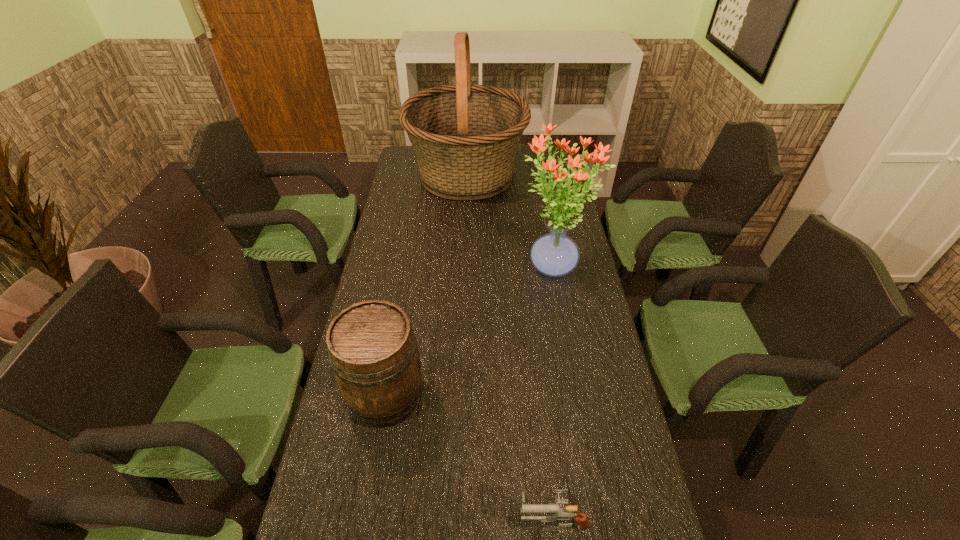
The height and width of the screenshot is (540, 960). What are the coordinates of `vacant space that satisfies the following two spatial constraints: 1. on the front side of the flower arrangement; 2. on the side of the second nearest object near the bung hole` in the screenshot? It's located at (572, 397).

At what (x,y) coordinates should I click in order to perform the action: click on vacant space that satisfies the following two spatial constraints: 1. on the front side of the flower arrangement; 2. on the right side of the farthest object. Please return your answer as a coordinate pair (x, y). The height and width of the screenshot is (540, 960). Looking at the image, I should click on (463, 269).